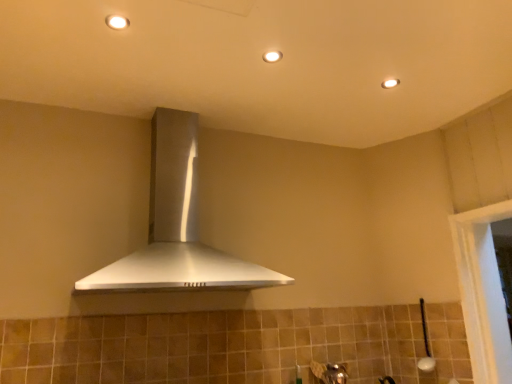
Question: Considering the relative sizes of satin silver range hood at center and matte white light fixture at upper center, positioned as the first light fixture in right-to-left order, in the image provided, is satin silver range hood at center taller than matte white light fixture at upper center, positioned as the first light fixture in right-to-left order,?

Choices:
 (A) yes
 (B) no

Answer: (A)

Question: Is satin silver range hood at center behind matte white light fixture at upper center, positioned as the third light fixture in left-to-right order?

Choices:
 (A) yes
 (B) no

Answer: (B)

Question: Is satin silver range hood at center to the left of matte white light fixture at upper center, positioned as the 3th light fixture in front-to-back order, from the viewer's perspective?

Choices:
 (A) yes
 (B) no

Answer: (A)

Question: Is satin silver range hood at center oriented towards matte white light fixture at upper center, positioned as the first light fixture in right-to-left order?

Choices:
 (A) yes
 (B) no

Answer: (B)

Question: Does satin silver range hood at center contain matte white light fixture at upper center, the 1th light fixture positioned from the back?

Choices:
 (A) yes
 (B) no

Answer: (B)

Question: From the image's perspective, is satin silver range hood at center located above matte white light fixture at upper center, which is counted as the third light fixture, starting from the top?

Choices:
 (A) yes
 (B) no

Answer: (B)

Question: Can you confirm if matte white light fixture at upper center, the second light fixture viewed from the front, is shorter than satin silver range hood at center?

Choices:
 (A) no
 (B) yes

Answer: (B)

Question: From the image's perspective, is matte white light fixture at upper center, positioned as the second light fixture in top-to-bottom order, on satin silver range hood at center?

Choices:
 (A) yes
 (B) no

Answer: (A)

Question: Can you confirm if matte white light fixture at upper center, which is the second light fixture in back-to-front order, is taller than satin silver range hood at center?

Choices:
 (A) yes
 (B) no

Answer: (B)

Question: Is matte white light fixture at upper center, the second light fixture viewed from the front, not near satin silver range hood at center?

Choices:
 (A) no
 (B) yes

Answer: (A)

Question: Is matte white light fixture at upper center, the second light fixture when ordered from left to right, bigger than satin silver range hood at center?

Choices:
 (A) yes
 (B) no

Answer: (B)

Question: Does matte white light fixture at upper center, which appears as the 2th light fixture when viewed from the right, come in front of satin silver range hood at center?

Choices:
 (A) yes
 (B) no

Answer: (B)

Question: Can you confirm if matte white light fixture at upper center, which is counted as the first light fixture, starting from the bottom, is thinner than white glossy light fixture at upper center, marked as the 3th light fixture in a back-to-front arrangement?

Choices:
 (A) yes
 (B) no

Answer: (B)